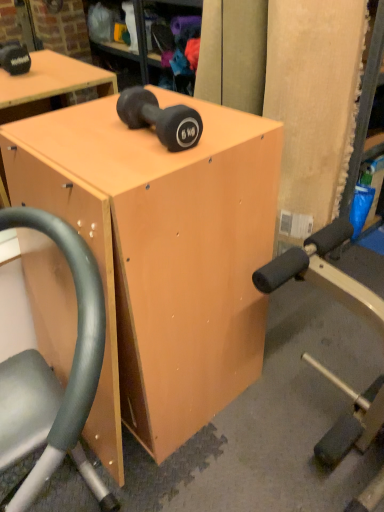
The width and height of the screenshot is (384, 512). In order to click on vacant point above matte wood table at center (from a real-world perspective) in this screenshot , I will do `click(112, 141)`.